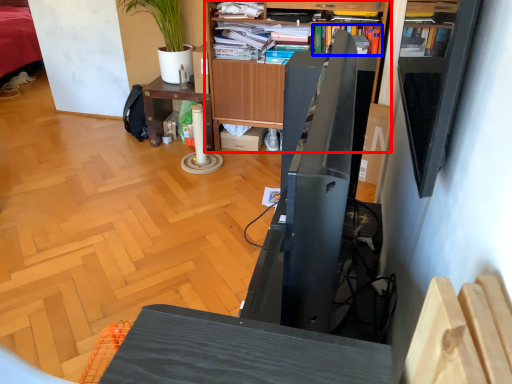
Question: Which object is further to the camera taking this photo, bookcase (highlighted by a red box) or book (highlighted by a blue box)?

Choices:
 (A) bookcase
 (B) book

Answer: (B)